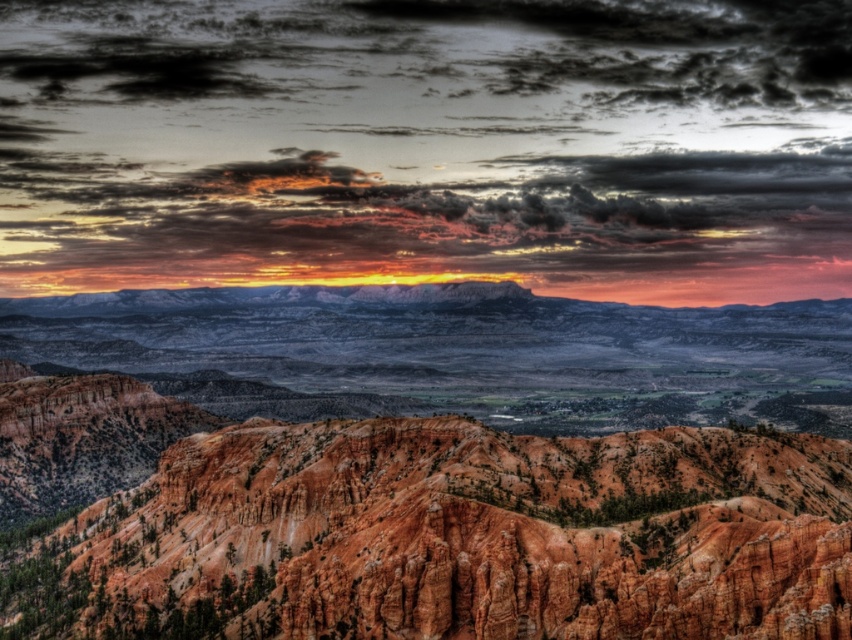
Question: Where is matte orange sky at upper center located in relation to rustic sandstone mountain at center in the image?

Choices:
 (A) below
 (B) above

Answer: (B)

Question: Which point is farther to the camera?

Choices:
 (A) matte orange sky at upper center
 (B) rustic sandstone mountain at center

Answer: (A)

Question: In this image, where is matte orange sky at upper center located relative to rustic sandstone mountain at center?

Choices:
 (A) right
 (B) left

Answer: (A)

Question: From the image, what is the correct spatial relationship of matte orange sky at upper center in relation to rustic sandstone mountain at center?

Choices:
 (A) left
 (B) right

Answer: (B)